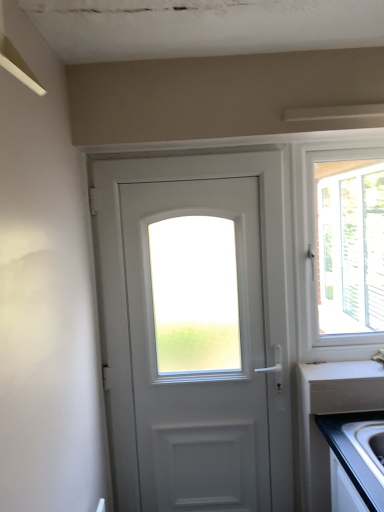
Question: Considering the relative sizes of white laminate countertop at lower right and silver metallic faucet at right in the image provided, is white laminate countertop at lower right wider than silver metallic faucet at right?

Choices:
 (A) no
 (B) yes

Answer: (A)

Question: Is white laminate countertop at lower right at the right side of silver metallic faucet at right?

Choices:
 (A) yes
 (B) no

Answer: (B)

Question: Is white laminate countertop at lower right behind silver metallic faucet at right?

Choices:
 (A) no
 (B) yes

Answer: (B)

Question: From a real-world perspective, is white laminate countertop at lower right physically below silver metallic faucet at right?

Choices:
 (A) no
 (B) yes

Answer: (B)

Question: Does white laminate countertop at lower right have a smaller size compared to silver metallic faucet at right?

Choices:
 (A) no
 (B) yes

Answer: (B)

Question: Considering the positions of white plastic window at right and silver metallic faucet at right in the image, is white plastic window at right taller or shorter than silver metallic faucet at right?

Choices:
 (A) short
 (B) tall

Answer: (B)

Question: Is white plastic window at right inside the boundaries of silver metallic faucet at right, or outside?

Choices:
 (A) outside
 (B) inside

Answer: (A)

Question: Is white plastic window at right wider or thinner than silver metallic faucet at right?

Choices:
 (A) wide
 (B) thin

Answer: (B)

Question: Relative to silver metallic faucet at right, is white plastic window at right in front or behind?

Choices:
 (A) front
 (B) behind

Answer: (B)

Question: From the image's perspective, is white matte door at center located above or below white plastic window at right?

Choices:
 (A) below
 (B) above

Answer: (A)

Question: In terms of height, does white matte door at center look taller or shorter compared to white plastic window at right?

Choices:
 (A) tall
 (B) short

Answer: (A)

Question: Considering the relative positions of white matte door at center and white plastic window at right in the image provided, is white matte door at center to the left or to the right of white plastic window at right?

Choices:
 (A) right
 (B) left

Answer: (B)

Question: Considering their positions, is white matte door at center located in front of or behind white plastic window at right?

Choices:
 (A) front
 (B) behind

Answer: (A)

Question: From their relative heights in the image, would you say white matte door at center is taller or shorter than white laminate countertop at lower right?

Choices:
 (A) tall
 (B) short

Answer: (A)

Question: From the image's perspective, relative to white laminate countertop at lower right, is white matte door at center above or below?

Choices:
 (A) below
 (B) above

Answer: (B)